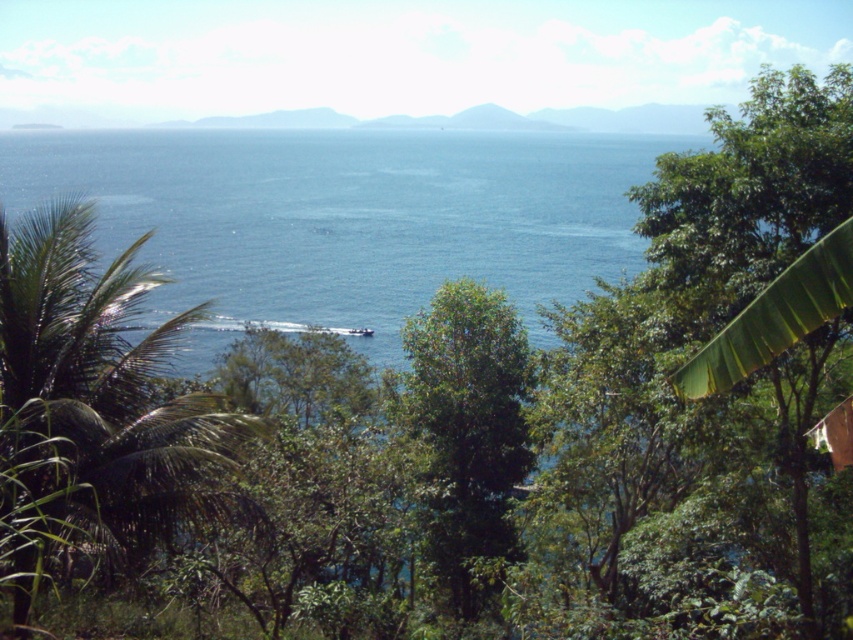
Can you confirm if green leafy palm tree at center-left is bigger than green leafy tree at center?

Yes.

Can you confirm if green leafy palm tree at center-left is smaller than green leafy tree at center?

Actually, green leafy palm tree at center-left might be larger than green leafy tree at center.

Image resolution: width=853 pixels, height=640 pixels. I want to click on green leafy palm tree at center-left, so click(x=91, y=406).